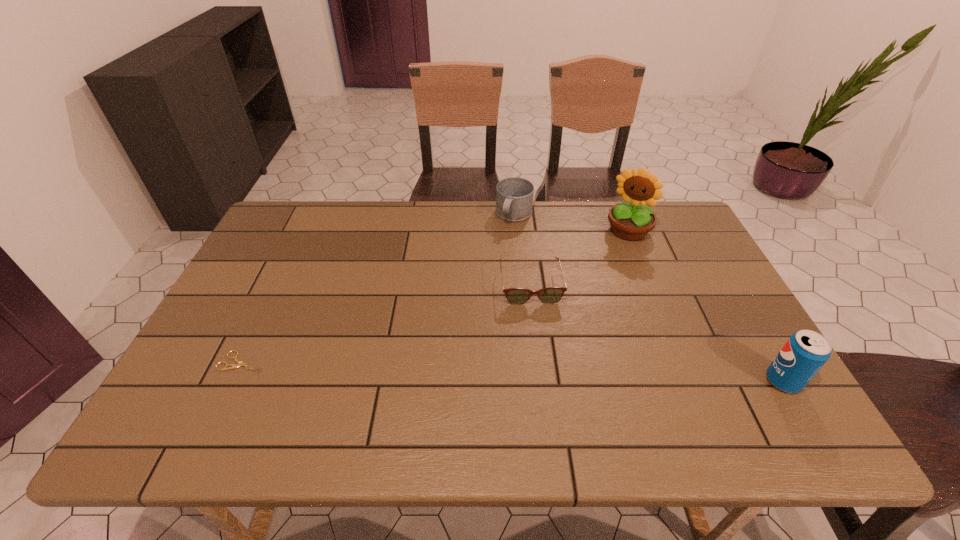
Where is `unoccupied position between the sunflower and the third shortest object`? Image resolution: width=960 pixels, height=540 pixels. unoccupied position between the sunflower and the third shortest object is located at coordinates (571, 223).

At what (x,y) coordinates should I click in order to perform the action: click on free area in between the rightmost object and the third tallest object. Please return your answer as a coordinate pair (x, y). The height and width of the screenshot is (540, 960). Looking at the image, I should click on (649, 298).

Find the location of a particular element. free spot between the sunflower and the leftmost object is located at coordinates (436, 296).

The width and height of the screenshot is (960, 540). I want to click on free space that is in between the fourth tallest object and the sunflower, so click(580, 258).

Image resolution: width=960 pixels, height=540 pixels. What are the coordinates of `vacant point located between the shortest object and the fourth shortest object` in the screenshot? It's located at (513, 372).

What are the coordinates of `free spot between the fourth shortest object and the second shortest object` in the screenshot? It's located at (657, 333).

Locate an element on the screen. The height and width of the screenshot is (540, 960). vacant space that's between the soda can and the third shortest object is located at coordinates (649, 298).

Locate which object is the third closest to the spectacles. Please provide its 2D coordinates. Your answer should be formatted as a tuple, i.e. [(x, y)], where the tuple contains the x and y coordinates of a point satisfying the conditions above.

[(806, 351)]

Locate which object ranks third in proximity to the shortest object. Please provide its 2D coordinates. Your answer should be formatted as a tuple, i.e. [(x, y)], where the tuple contains the x and y coordinates of a point satisfying the conditions above.

[(632, 220)]

This screenshot has width=960, height=540. Find the location of `free spot that satisfies the following two spatial constraints: 1. on the front side of the second tallest object; 2. on the right side of the leftmost object`. free spot that satisfies the following two spatial constraints: 1. on the front side of the second tallest object; 2. on the right side of the leftmost object is located at coordinates (233, 381).